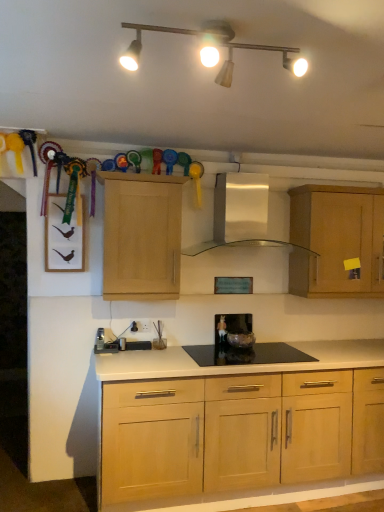
Question: From the image's perspective, does light wood cabinet at center, which appears as the 2th cabinetry when viewed from the back, appear higher than black glass gas stove at center?

Choices:
 (A) no
 (B) yes

Answer: (B)

Question: Is light wood cabinet at center, the 2th cabinetry positioned from the right, not close to black glass gas stove at center?

Choices:
 (A) yes
 (B) no

Answer: (B)

Question: Is light wood cabinet at center, the 2th cabinetry positioned from the right, beside black glass gas stove at center?

Choices:
 (A) no
 (B) yes

Answer: (A)

Question: Is light wood cabinet at center, which appears as the 2th cabinetry when viewed from the back, taller than black glass gas stove at center?

Choices:
 (A) yes
 (B) no

Answer: (A)

Question: From a real-world perspective, is light wood cabinet at center, the 2th cabinetry positioned from the right, on top of black glass gas stove at center?

Choices:
 (A) no
 (B) yes

Answer: (B)

Question: Could you tell me if light wood cabinet at center, which appears as the 2th cabinetry when viewed from the back, is facing black glass gas stove at center?

Choices:
 (A) no
 (B) yes

Answer: (A)

Question: Is light wood cabinet at center, which appears as the 2th cabinetry when viewed from the back, completely or partially inside matte white track lights at upper center?

Choices:
 (A) no
 (B) yes

Answer: (A)

Question: Can you confirm if matte white track lights at upper center is positioned to the left of light wood cabinet at center, which appears as the 2th cabinetry when viewed from the back?

Choices:
 (A) no
 (B) yes

Answer: (A)

Question: From a real-world perspective, is matte white track lights at upper center located higher than light wood cabinet at center, the 2th cabinetry positioned from the right?

Choices:
 (A) no
 (B) yes

Answer: (B)

Question: Is matte white track lights at upper center shorter than light wood cabinet at center, the 2th cabinetry positioned from the right?

Choices:
 (A) yes
 (B) no

Answer: (A)

Question: Is matte white track lights at upper center to the right of light wood cabinet at center, which appears as the 2th cabinetry when viewed from the back, from the viewer's perspective?

Choices:
 (A) yes
 (B) no

Answer: (A)

Question: Considering the relative sizes of matte white track lights at upper center and light wood cabinet at center, the 2th cabinetry positioned from the right, in the image provided, is matte white track lights at upper center wider than light wood cabinet at center, the 2th cabinetry positioned from the right,?

Choices:
 (A) yes
 (B) no

Answer: (A)

Question: Does matte glass bowl at center, the 1th appliance viewed from the right, have a lesser height compared to matte white track lights at upper center?

Choices:
 (A) yes
 (B) no

Answer: (B)